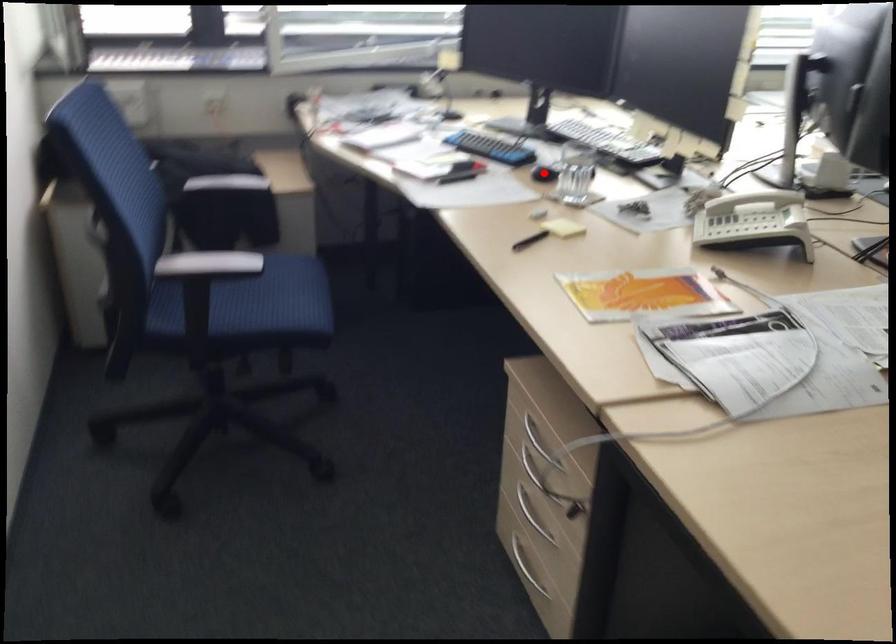
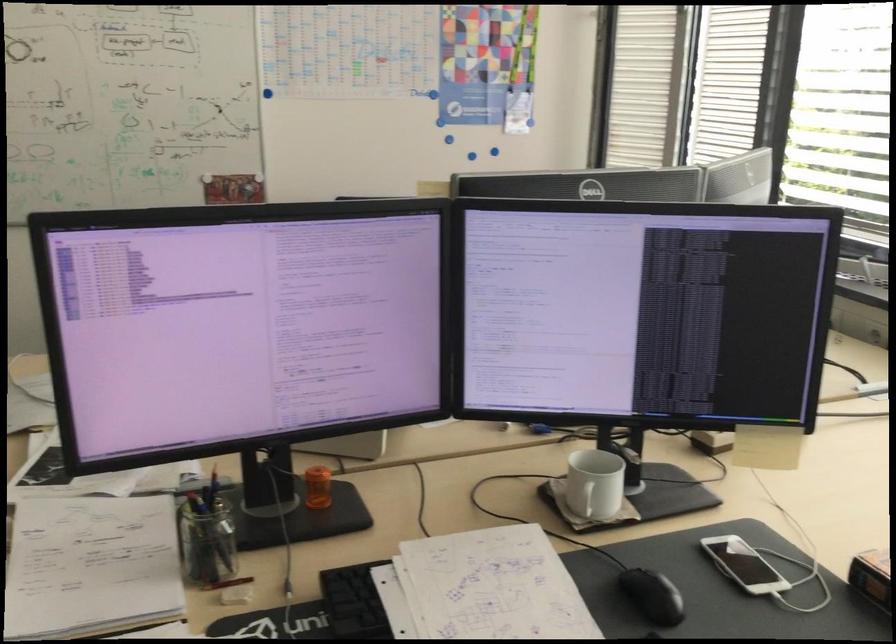
Question: I am providing you with two images of the same scene from different viewpoints. A red point is marked on the first image. Can you still see the location of the red point in image 2?

Choices:
 (A) Yes
 (B) No

Answer: (B)